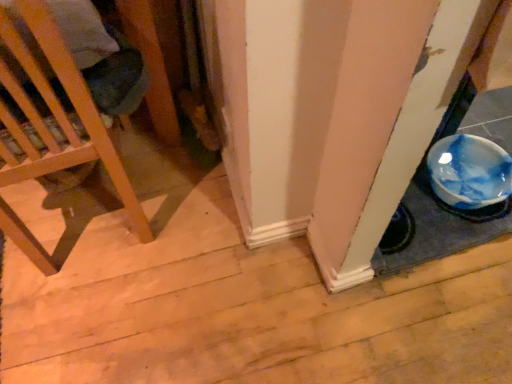
In order to click on free location to the right of wooden chair at left in this screenshot , I will do `click(199, 223)`.